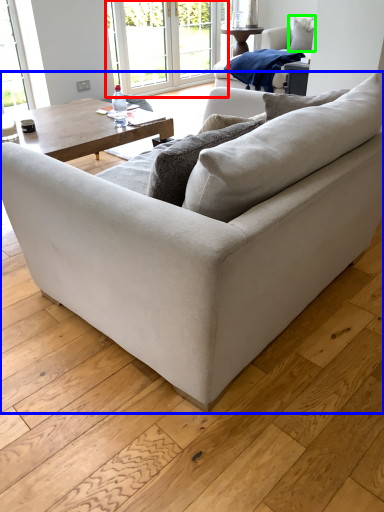
Question: Which object is the farthest from window frame (highlighted by a red box)? Choose among these: studio couch (highlighted by a blue box) or pillow (highlighted by a green box).

Choices:
 (A) studio couch
 (B) pillow

Answer: (A)